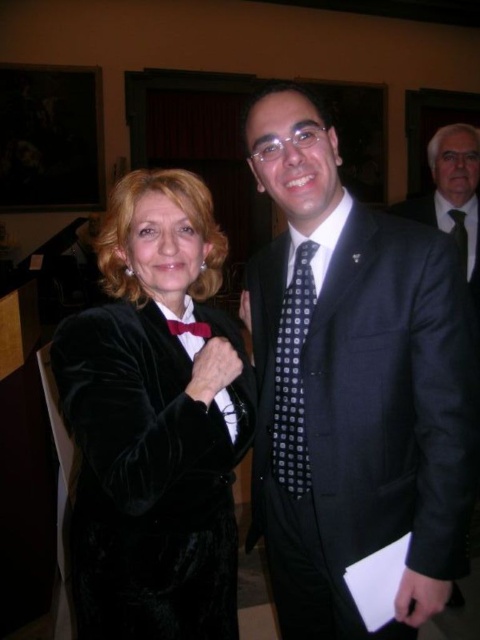
You are a photographer trying to frame a portrait of the two individuals. You want to ensure that both the black silk suit at center and the dark blue dotted tie at center are clearly visible in the frame. Given their positions and sizes, can you fit both into the frame without cropping either of them?

The black silk suit at center might be wider than dark blue dotted tie at center, so you need to adjust the frame to accommodate the width of the black silk suit at center to ensure both are visible without cropping.

Where is the black silk suit at center located in the image?

The black silk suit at center is located at point 0.303 in the x coordinate and 0.948 in the y coordinate.